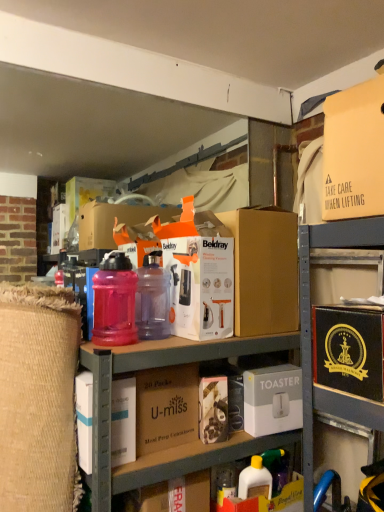
In order to face purple translucent bottle at center, which is the second bottle in left-to-right order, should I rotate leftwards or rightwards?

To align with it, rotate left about 4.672°.

You are a GUI agent. You are given a task and a screenshot of the screen. Output one action in this format:
    pyautogui.click(x=<x>, y=<y>)
    Task: Click on the brown cardboard box at center, positioned as the fifth box in bottom-to-top order
    Image resolution: width=384 pixels, height=512 pixels.
    Given the screenshot: What is the action you would take?
    coord(264,270)

I want to click on translucent pink plastic water bottle at center-left, placed as the 1th bottle when sorted from left to right, so click(114, 301).

You are a GUI agent. You are given a task and a screenshot of the screen. Output one action in this format:
    pyautogui.click(x=<x>, y=<y>)
    Task: Click on the white cardboard box at lower center
    This screenshot has width=384, height=512.
    Given the screenshot: What is the action you would take?
    pyautogui.click(x=270, y=500)

In order to click on purple translucent bottle at center, which is the second bottle in left-to-right order in this screenshot , I will do `click(152, 298)`.

Is matte plastic containers at center to the left or to the right of white cardboard toaster at center, positioned as the 1th box in bottom-to-top order, in the image?

Clearly, matte plastic containers at center is on the left of white cardboard toaster at center, positioned as the 1th box in bottom-to-top order, in the image.

From a real-world perspective, relative to white cardboard toaster at center, positioned as the 1th box in bottom-to-top order, is matte plastic containers at center vertically above or below?

matte plastic containers at center is below white cardboard toaster at center, positioned as the 1th box in bottom-to-top order.

Is matte plastic containers at center turned away from white cardboard toaster at center, positioned as the 1th box in bottom-to-top order?

Absolutely, matte plastic containers at center is directed away from white cardboard toaster at center, positioned as the 1th box in bottom-to-top order.

Can you confirm if matte plastic containers at center is smaller than white cardboard toaster at center, positioned as the 1th box in bottom-to-top order?

Incorrect, matte plastic containers at center is not smaller in size than white cardboard toaster at center, positioned as the 1th box in bottom-to-top order.

From the image's perspective, is matte cardboard box at upper right, which is counted as the first box, starting from the top, above or below purple translucent bottle at center, which ranks as the 1th bottle in right-to-left order?

matte cardboard box at upper right, which is counted as the first box, starting from the top, is situated higher than purple translucent bottle at center, which ranks as the 1th bottle in right-to-left order, in the image.

Is the position of matte cardboard box at upper right, placed as the 6th box when sorted from bottom to top, more distant than that of purple translucent bottle at center, which ranks as the 1th bottle in right-to-left order?

No, matte cardboard box at upper right, placed as the 6th box when sorted from bottom to top, is closer to the viewer.

Is matte cardboard box at upper right, which is counted as the first box, starting from the top, located outside purple translucent bottle at center, which is the second bottle in left-to-right order?

Yes, matte cardboard box at upper right, which is counted as the first box, starting from the top, is outside of purple translucent bottle at center, which is the second bottle in left-to-right order.

Is matte cardboard box at upper right, which is counted as the first box, starting from the top, touching purple translucent bottle at center, which is the second bottle in left-to-right order?

No, matte cardboard box at upper right, which is counted as the first box, starting from the top, is not with purple translucent bottle at center, which is the second bottle in left-to-right order.

Is brown cardboard box at center, which is the fourth box from top to bottom, to the right of matte cardboard box at upper right, which is counted as the first box, starting from the top, from the viewer's perspective?

No, brown cardboard box at center, which is the fourth box from top to bottom, is not to the right of matte cardboard box at upper right, which is counted as the first box, starting from the top.

From the image's perspective, which one is positioned higher, brown cardboard box at center, which is the third box in bottom-to-top order, or matte cardboard box at upper right, which is counted as the first box, starting from the top?

matte cardboard box at upper right, which is counted as the first box, starting from the top.

Between point (136, 442) and point (373, 100), which one is positioned in front?

Point (373, 100)

Which object is more forward, black cardboard box at right, which is the 4th box from bottom to top, or white cardboard box at lower center?

Positioned in front is black cardboard box at right, which is the 4th box from bottom to top.

Can you see black cardboard box at right, the 3th box viewed from the top, touching white cardboard box at lower center?

black cardboard box at right, the 3th box viewed from the top, and white cardboard box at lower center are clearly separated.

Is black cardboard box at right, the 3th box viewed from the top, taller or shorter than white cardboard box at lower center?

Considering their sizes, black cardboard box at right, the 3th box viewed from the top, has less height than white cardboard box at lower center.

Can you tell me how much black cardboard box at right, which is the 4th box from bottom to top, and white cardboard box at lower center differ in facing direction?

There is a 89.8-degree angle between the facing directions of black cardboard box at right, which is the 4th box from bottom to top, and white cardboard box at lower center.

In the image, is matte plastic containers at center positioned in front of or behind purple translucent bottle at center, which ranks as the 1th bottle in right-to-left order?

matte plastic containers at center is positioned closer to the viewer than purple translucent bottle at center, which ranks as the 1th bottle in right-to-left order.

Would you say matte plastic containers at center is a long distance from purple translucent bottle at center, which ranks as the 1th bottle in right-to-left order?

No, matte plastic containers at center is in close proximity to purple translucent bottle at center, which ranks as the 1th bottle in right-to-left order.

Is matte plastic containers at center bigger than purple translucent bottle at center, which is the second bottle in left-to-right order?

Yes, matte plastic containers at center is bigger than purple translucent bottle at center, which is the second bottle in left-to-right order.

Is matte plastic containers at center to the left or to the right of purple translucent bottle at center, which is the second bottle in left-to-right order, in the image?

From the image, it's evident that matte plastic containers at center is to the right of purple translucent bottle at center, which is the second bottle in left-to-right order.

Is white cardboard box at lower center spatially inside purple translucent bottle at center, which ranks as the 1th bottle in right-to-left order, or outside of it?

white cardboard box at lower center is outside purple translucent bottle at center, which ranks as the 1th bottle in right-to-left order.

Which of these two, white cardboard box at lower center or purple translucent bottle at center, which is the second bottle in left-to-right order, is thinner?

Thinner between the two is purple translucent bottle at center, which is the second bottle in left-to-right order.

From a real-world perspective, which object rests below the other?

white cardboard box at lower center.

Between white cardboard box at lower center and purple translucent bottle at center, which ranks as the 1th bottle in right-to-left order, which one appears on the right side from the viewer's perspective?

white cardboard box at lower center.

Find the location of a particular element. The height and width of the screenshot is (512, 384). the 3rd box directly above the white cardboard box at lower left, positioned as the 5th box in top-to-bottom order (from a real-world perspective) is located at coordinates (264, 270).

From a real-world perspective, which is physically below, white cardboard box at lower left, placed as the second box when sorted from bottom to top, or brown cardboard box at center, positioned as the fifth box in bottom-to-top order?

white cardboard box at lower left, placed as the second box when sorted from bottom to top.

Does white cardboard box at lower left, positioned as the 5th box in top-to-bottom order, appear on the right side of brown cardboard box at center, positioned as the fifth box in bottom-to-top order?

Incorrect, white cardboard box at lower left, positioned as the 5th box in top-to-bottom order, is not on the right side of brown cardboard box at center, positioned as the fifth box in bottom-to-top order.

Could brown cardboard box at center, positioned as the fifth box in bottom-to-top order, be considered to be inside white cardboard box at lower left, positioned as the 5th box in top-to-bottom order?

No, white cardboard box at lower left, positioned as the 5th box in top-to-bottom order, does not contain brown cardboard box at center, positioned as the fifth box in bottom-to-top order.

In order to click on shelf below the white cardboard toaster at center, the 6th box from the top (from the image's perspective) in this screenshot , I will do `click(177, 446)`.

Image resolution: width=384 pixels, height=512 pixels. What are the coordinates of `the 2nd box above when counting from the purple translucent bottle at center, which ranks as the 1th bottle in right-to-left order (from the image's perspective)` in the screenshot? It's located at (354, 152).

Estimate the real-world distances between objects in this image. Which object is further from white cardboard toaster at center, positioned as the 1th box in bottom-to-top order, white cardboard box at lower center or translucent pink plastic water bottle at center-left, placed as the second bottle when sorted from right to left?

translucent pink plastic water bottle at center-left, placed as the second bottle when sorted from right to left, is positioned further to the anchor white cardboard toaster at center, positioned as the 1th box in bottom-to-top order.

Estimate the real-world distances between objects in this image. Which object is closer to yellow plastic bottle at lower center, brown cardboard box at center, which is the fourth box from top to bottom, or purple translucent bottle at center, which is the second bottle in left-to-right order?

Based on the image, brown cardboard box at center, which is the fourth box from top to bottom, appears to be nearer to yellow plastic bottle at lower center.

Based on their spatial positions, is matte plastic containers at center or white cardboard box at lower left, placed as the second box when sorted from bottom to top, closer to purple translucent bottle at center, which is the second bottle in left-to-right order?

The object closer to purple translucent bottle at center, which is the second bottle in left-to-right order, is matte plastic containers at center.

Estimate the real-world distances between objects in this image. Which object is closer to yellow plastic bottle at lower center, white cardboard toaster at center, the 6th box from the top, or matte plastic containers at center?

Among the two, white cardboard toaster at center, the 6th box from the top, is located nearer to yellow plastic bottle at lower center.

Consider the image. Which object lies nearer to the anchor point white cardboard box at lower center, white cardboard toaster at center, positioned as the 1th box in bottom-to-top order, or yellow plastic bottle at lower center?

yellow plastic bottle at lower center lies closer to white cardboard box at lower center than the other object.

When comparing their distances from white cardboard toaster at center, positioned as the 1th box in bottom-to-top order, does yellow plastic bottle at lower center or translucent pink plastic water bottle at center-left, placed as the second bottle when sorted from right to left, seem closer?

Based on the image, yellow plastic bottle at lower center appears to be nearer to white cardboard toaster at center, positioned as the 1th box in bottom-to-top order.

Based on their spatial positions, is matte plastic containers at center or brown cardboard box at center, positioned as the fifth box in bottom-to-top order, closer to white cardboard toaster at center, the 6th box from the top?

The object closer to white cardboard toaster at center, the 6th box from the top, is matte plastic containers at center.

Consider the image. From the image, which object appears to be nearer to matte plastic containers at center, white cardboard box at lower left, positioned as the 5th box in top-to-bottom order, or purple translucent bottle at center, which ranks as the 1th bottle in right-to-left order?

white cardboard box at lower left, positioned as the 5th box in top-to-bottom order, is closer to matte plastic containers at center.

Locate an element on the screen. The height and width of the screenshot is (512, 384). bottle between translucent pink plastic water bottle at center-left, placed as the second bottle when sorted from right to left, and white cardboard box at lower left, positioned as the 5th box in top-to-bottom order, vertically is located at coordinates (152, 298).

The width and height of the screenshot is (384, 512). What are the coordinates of `shelf between white cardboard box at lower left, placed as the second box when sorted from bottom to top, and white cardboard box at lower center, in the horizontal direction` in the screenshot? It's located at (177, 446).

The width and height of the screenshot is (384, 512). I want to click on storage box between white cardboard box at lower left, placed as the second box when sorted from bottom to top, and white cardboard toaster at center, positioned as the 1th box in bottom-to-top order, in the horizontal direction, so click(270, 500).

The image size is (384, 512). I want to click on shelf between brown cardboard box at center, positioned as the fifth box in bottom-to-top order, and white cardboard box at lower center vertically, so click(177, 446).